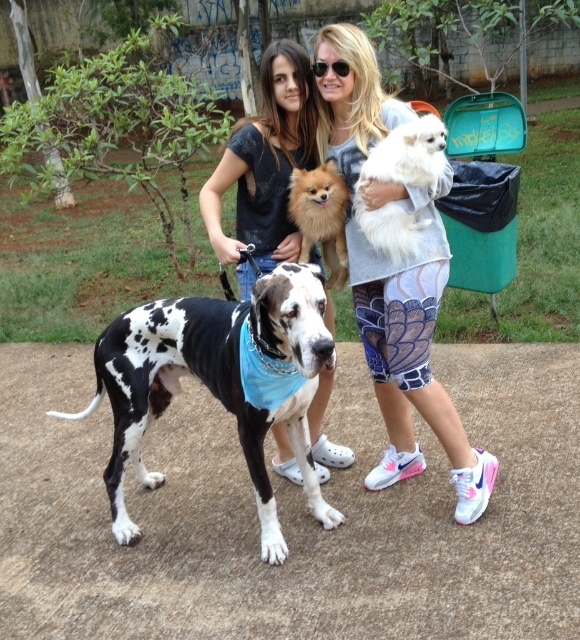
You are a photographer planning to take a group photo of the black and white spotted dog at center and the fuzzy brown dog at center. Which dog should stand in the front row to ensure both are visible in the photo?

The fuzzy brown dog at center should stand in the front row because the black and white spotted dog at center is much taller, so placing the shorter fuzzy brown dog at center in front will allow both to be visible.

You are a photographer setting up a tripod in the park. You want to position the tripod so that it can capture both the black and white spotted dog at center and the white fluffy dog at center without moving the tripod. Which dog requires the tripod to be placed further back to ensure it fits in the frame?

The black and white spotted dog at center has a greater width than the white fluffy dog at center, so the tripod should be placed further back to accommodate its larger size.

You are a photographer trying to capture a photo of the fuzzy brown dog at center. You notice the white printed leggings at center are blocking your view. Can you move to the left or right to get a clear shot without moving the leggings?

The white printed leggings at center are to the right of the fuzzy brown dog at center, so moving to the left would allow you to see the fuzzy brown dog at center without the leggings blocking the view.